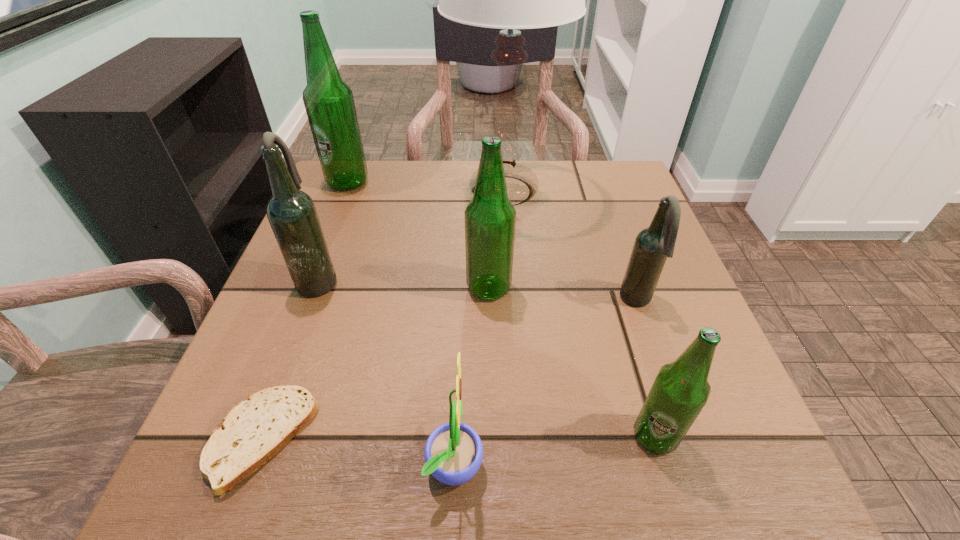
Image resolution: width=960 pixels, height=540 pixels. Identify the location of the tallest object. (509, 0).

I want to click on the second tallest object, so click(x=329, y=103).

Find the location of a particular element. the biggest green beer bottle is located at coordinates (329, 103).

Image resolution: width=960 pixels, height=540 pixels. I want to click on the second nearest green beer bottle, so [490, 217].

Where is `the second smallest green beer bottle`? This screenshot has height=540, width=960. the second smallest green beer bottle is located at coordinates (490, 217).

Identify the location of the bigger dark beer bottle. (292, 214).

The height and width of the screenshot is (540, 960). Identify the location of the right dark beer bottle. (652, 246).

Where is `the rightmost green beer bottle`? the rightmost green beer bottle is located at coordinates (680, 391).

At what (x,y) coordinates should I click in order to perform the action: click on the nearest green beer bottle. Please return your answer as a coordinate pair (x, y). Image resolution: width=960 pixels, height=540 pixels. Looking at the image, I should click on (680, 391).

Find the location of a particular element. The height and width of the screenshot is (540, 960). sunflower is located at coordinates (453, 453).